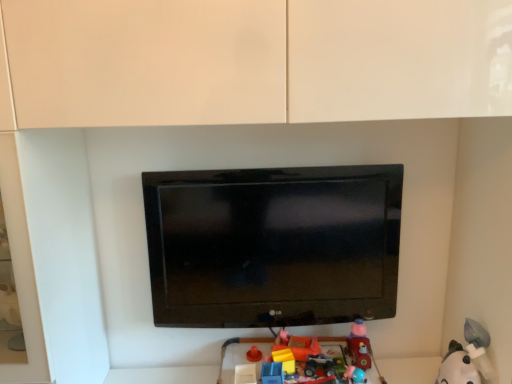
Question: Is white plush toy at lower right, placed as the 4th toy when sorted from left to right, in front of or behind blue plastic toy at lower center, marked as the 4th toy in a right-to-left arrangement, in the image?

Choices:
 (A) front
 (B) behind

Answer: (A)

Question: From a real-world perspective, is white plush toy at lower right, which is the first toy from right to left, physically located above or below blue plastic toy at lower center, marked as the 4th toy in a right-to-left arrangement?

Choices:
 (A) below
 (B) above

Answer: (A)

Question: Which object is positioned farthest from the blue plastic toy at lower center, acting as the first toy starting from the left?

Choices:
 (A) white plush toy at lower right, placed as the 4th toy when sorted from left to right
 (B) matte plastic toy car at lower right, the 3th toy positioned from the left
 (C) black glossy tv at center
 (D) rubberized plastic toy at lower center, which is the 3th toy from right to left

Answer: (A)

Question: Which of these objects is positioned farthest from the black glossy tv at center?

Choices:
 (A) matte plastic toy car at lower right, the 3th toy positioned from the left
 (B) blue plastic toy at lower center, marked as the 4th toy in a right-to-left arrangement
 (C) rubberized plastic toy at lower center, which is the second toy in left-to-right order
 (D) white plush toy at lower right, which is the first toy from right to left

Answer: (D)